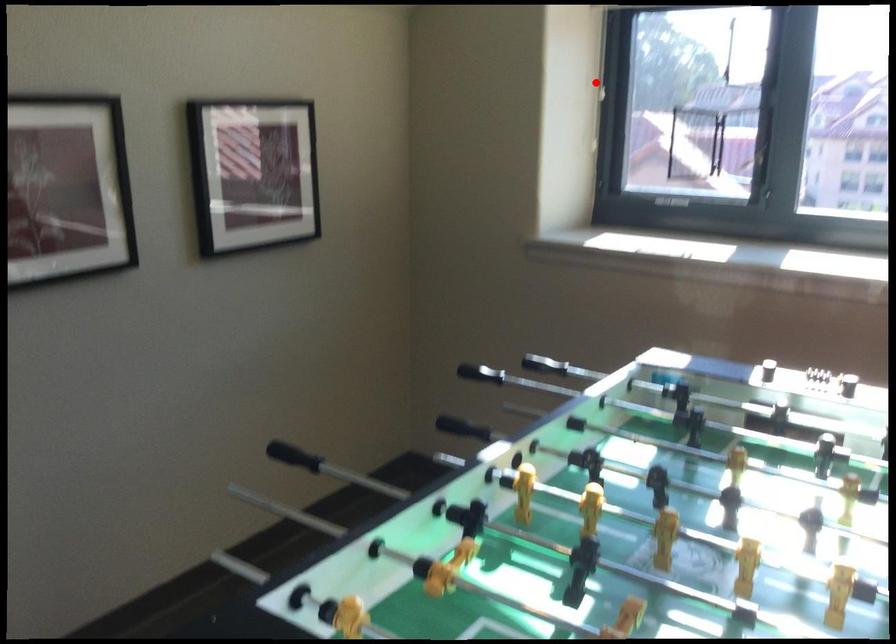
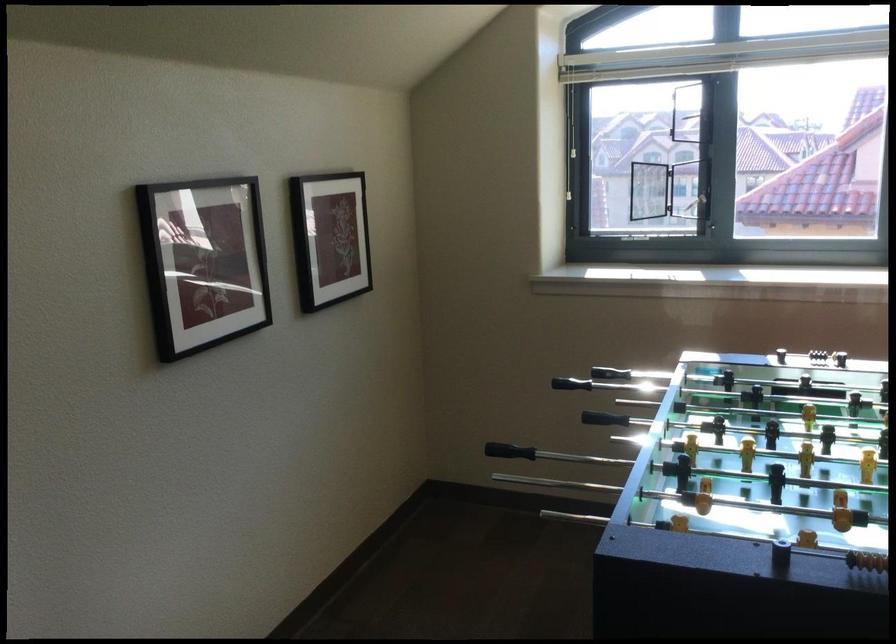
In the second image, find the point that corresponds to the highlighted location in the first image.

(567, 138)